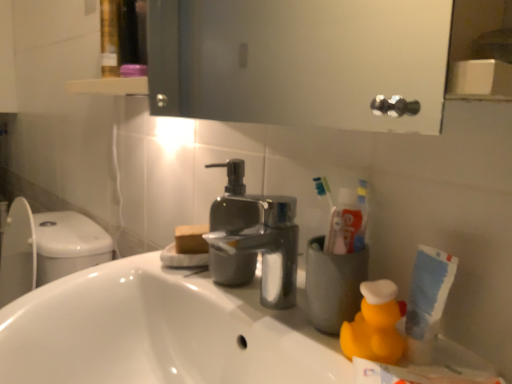
Question: Can you confirm if white glossy sink at lower left is positioned to the left of polished metallic faucet at center?

Choices:
 (A) no
 (B) yes

Answer: (B)

Question: Does white glossy sink at lower left have a greater height compared to polished metallic faucet at center?

Choices:
 (A) yes
 (B) no

Answer: (A)

Question: From a real-world perspective, is white glossy sink at lower left beneath polished metallic faucet at center?

Choices:
 (A) yes
 (B) no

Answer: (A)

Question: Does white glossy sink at lower left touch polished metallic faucet at center?

Choices:
 (A) yes
 (B) no

Answer: (B)

Question: Is white glossy sink at lower left looking in the opposite direction of polished metallic faucet at center?

Choices:
 (A) no
 (B) yes

Answer: (A)

Question: Does white glossy sink at lower left have a lesser height compared to polished metallic faucet at center?

Choices:
 (A) no
 (B) yes

Answer: (A)

Question: Considering the relative sizes of yellow rubber duck at lower right and polished metallic faucet at center in the image provided, is yellow rubber duck at lower right bigger than polished metallic faucet at center?

Choices:
 (A) yes
 (B) no

Answer: (B)

Question: Is yellow rubber duck at lower right not close to polished metallic faucet at center?

Choices:
 (A) no
 (B) yes

Answer: (A)

Question: Is yellow rubber duck at lower right positioned with its back to polished metallic faucet at center?

Choices:
 (A) yes
 (B) no

Answer: (B)

Question: From a real-world perspective, is yellow rubber duck at lower right on top of polished metallic faucet at center?

Choices:
 (A) no
 (B) yes

Answer: (A)

Question: Is the depth of yellow rubber duck at lower right less than that of polished metallic faucet at center?

Choices:
 (A) no
 (B) yes

Answer: (B)

Question: Considering the relative sizes of yellow rubber duck at lower right and polished metallic faucet at center in the image provided, is yellow rubber duck at lower right thinner than polished metallic faucet at center?

Choices:
 (A) yes
 (B) no

Answer: (A)

Question: Is yellow rubber duck at lower right taller than white glossy sink at lower left?

Choices:
 (A) yes
 (B) no

Answer: (B)